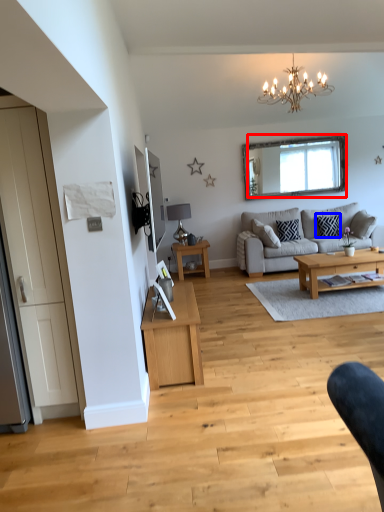
Question: Which of the following is the farthest to the observer, mirror (highlighted by a red box) or pillow (highlighted by a blue box)?

Choices:
 (A) mirror
 (B) pillow

Answer: (A)